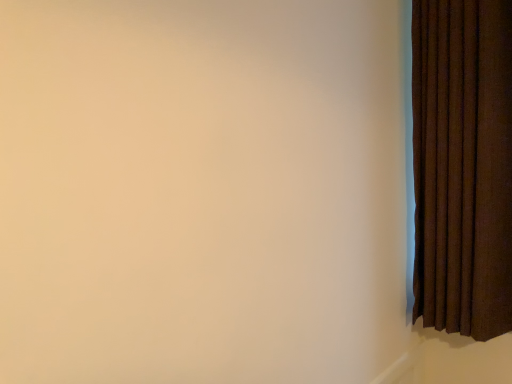
The height and width of the screenshot is (384, 512). What do you see at coordinates (463, 165) in the screenshot?
I see `brown textured curtain at right` at bounding box center [463, 165].

This screenshot has height=384, width=512. In order to click on brown textured curtain at right in this screenshot , I will do `click(463, 165)`.

This screenshot has width=512, height=384. Find the location of `brown textured curtain at right`. brown textured curtain at right is located at coordinates (463, 165).